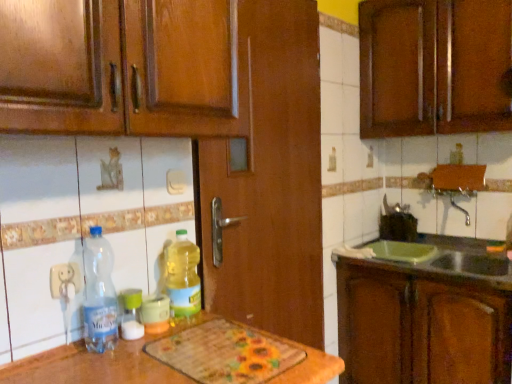
Question: Is translucent plastic bottle at center, which ranks as the third bottle in left-to-right order, at the left side of brown wood cabinet at right, marked as the first cabinetry in a bottom-to-top arrangement?

Choices:
 (A) yes
 (B) no

Answer: (A)

Question: Is translucent plastic bottle at center, which is the 1th bottle from right to left, behind brown wood cabinet at right, the second cabinetry viewed from the top?

Choices:
 (A) yes
 (B) no

Answer: (B)

Question: Does translucent plastic bottle at center, which ranks as the third bottle in left-to-right order, have a smaller size compared to brown wood cabinet at right, the second cabinetry viewed from the top?

Choices:
 (A) no
 (B) yes

Answer: (B)

Question: Can you confirm if translucent plastic bottle at center, which ranks as the third bottle in left-to-right order, is taller than brown wood cabinet at right, the second cabinetry viewed from the top?

Choices:
 (A) yes
 (B) no

Answer: (B)

Question: From the image's perspective, would you say translucent plastic bottle at center, which ranks as the third bottle in left-to-right order, is positioned over brown wood cabinet at right, marked as the first cabinetry in a bottom-to-top arrangement?

Choices:
 (A) no
 (B) yes

Answer: (B)

Question: Considering the relative positions of clear plastic bottle at lower left, the first bottle positioned from the left, and translucent plastic bottle at center, which is the 1th bottle from right to left, in the image provided, is clear plastic bottle at lower left, the first bottle positioned from the left, to the left or to the right of translucent plastic bottle at center, which is the 1th bottle from right to left,?

Choices:
 (A) right
 (B) left

Answer: (B)

Question: From the image's perspective, is clear plastic bottle at lower left, which appears as the third bottle when viewed from the right, above or below translucent plastic bottle at center, which is the 1th bottle from right to left?

Choices:
 (A) above
 (B) below

Answer: (A)

Question: Would you say clear plastic bottle at lower left, the first bottle positioned from the left, is inside or outside translucent plastic bottle at center, which is the 1th bottle from right to left?

Choices:
 (A) inside
 (B) outside

Answer: (B)

Question: From a real-world perspective, is clear plastic bottle at lower left, which appears as the third bottle when viewed from the right, positioned above or below translucent plastic bottle at center, which is the 1th bottle from right to left?

Choices:
 (A) above
 (B) below

Answer: (A)

Question: Is brown wood cabinet at right, the second cabinetry viewed from the top, taller or shorter than clear plastic bottle at lower left, the first bottle positioned from the left?

Choices:
 (A) tall
 (B) short

Answer: (A)

Question: In terms of size, does brown wood cabinet at right, marked as the first cabinetry in a bottom-to-top arrangement, appear bigger or smaller than clear plastic bottle at lower left, the first bottle positioned from the left?

Choices:
 (A) small
 (B) big

Answer: (B)

Question: Would you say brown wood cabinet at right, the second cabinetry viewed from the top, is to the left or to the right of clear plastic bottle at lower left, the first bottle positioned from the left, in the picture?

Choices:
 (A) left
 (B) right

Answer: (B)

Question: Does point (415, 372) appear closer or farther from the camera than point (87, 334)?

Choices:
 (A) closer
 (B) farther

Answer: (B)

Question: Is translucent plastic bottle at center, positioned as the second bottle in right-to-left order, spatially inside brown wood cabinet at right, the second cabinetry viewed from the top, or outside of it?

Choices:
 (A) outside
 (B) inside

Answer: (A)

Question: Is translucent plastic bottle at center, positioned as the second bottle in right-to-left order, in front of or behind brown wood cabinet at right, the second cabinetry viewed from the top, in the image?

Choices:
 (A) behind
 (B) front

Answer: (B)